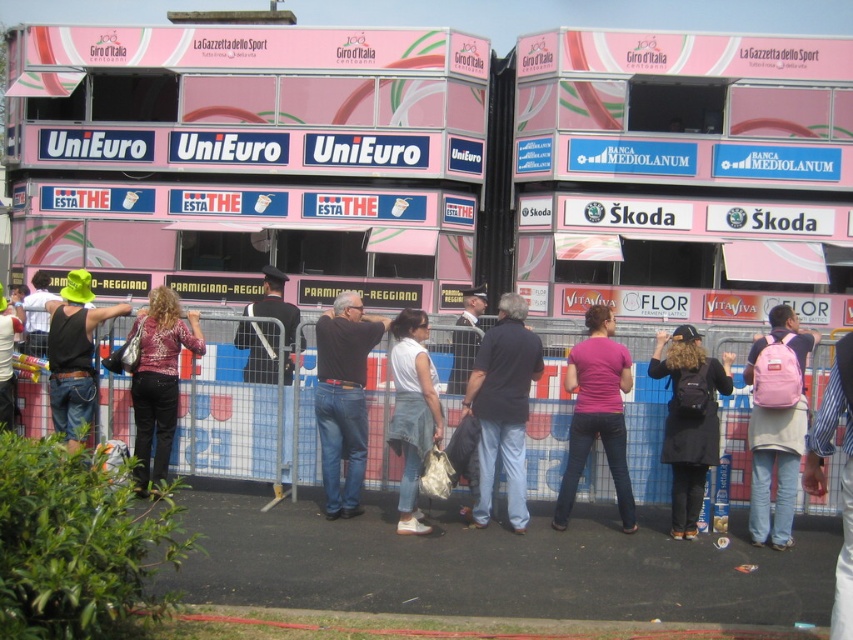
Question: Observing the image, what is the correct spatial positioning of black backpack at center in reference to matte black jacket at center?

Choices:
 (A) above
 (B) below

Answer: (B)

Question: Is dark blue jeans at center bigger than pink fabric backpack at center right?

Choices:
 (A) yes
 (B) no

Answer: (B)

Question: Among these objects, which one is farthest from the camera?

Choices:
 (A) dark blue jeans at center
 (B) black backpack at center

Answer: (A)

Question: Which of these objects is positioned closest to the pink backpack at center?

Choices:
 (A) denim jacket at left
 (B) black uniform at center
 (C) denim jeans at left

Answer: (C)

Question: Is denim jeans at left to the right of light brown leather jacket at center from the viewer's perspective?

Choices:
 (A) no
 (B) yes

Answer: (A)

Question: Which of the following is the farthest from the observer?

Choices:
 (A) (714, 440)
 (B) (479, 305)
 (C) (35, 282)

Answer: (C)